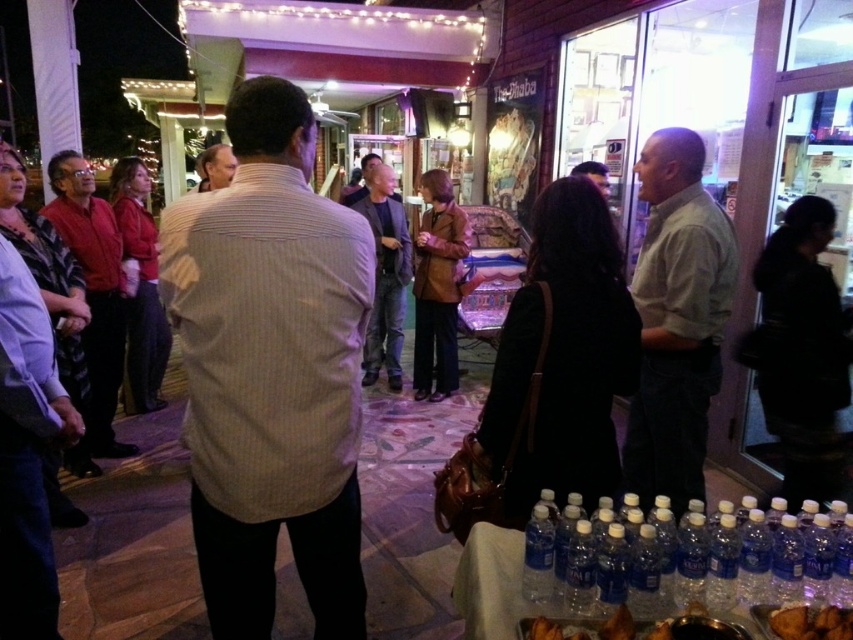
Question: Is dark gray jeans at center further to camera compared to matte black shirt at center?

Choices:
 (A) yes
 (B) no

Answer: (A)

Question: Considering the real-world distances, which object is closest to the brown crispy bread at lower right?

Choices:
 (A) light green shirt at center
 (B) light brown striped shirt at center

Answer: (B)

Question: Can you confirm if clear plastic bottles at lower right is wider than matte black shirt at center?

Choices:
 (A) no
 (B) yes

Answer: (B)

Question: Is light green shirt at center to the right of dark gray jeans at center from the viewer's perspective?

Choices:
 (A) no
 (B) yes

Answer: (B)

Question: Which of the following is the closest to the observer?

Choices:
 (A) (219, 188)
 (B) (294, 154)

Answer: (B)

Question: Among these objects, which one is nearest to the camera?

Choices:
 (A) light brown striped shirt at center
 (B) clear plastic bottles at lower right
 (C) red shirt at left

Answer: (B)